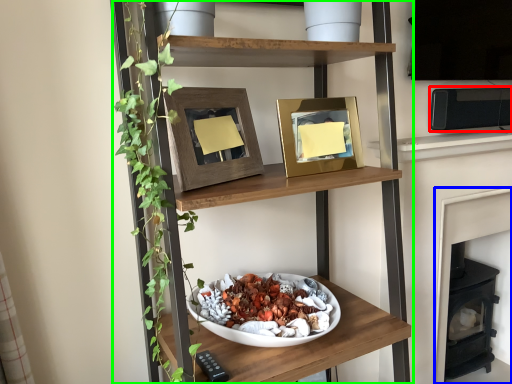
Question: Considering the real-world distances, which object is closest to appliance (highlighted by a red box)? fireplace (highlighted by a blue box) or shelf (highlighted by a green box).

Choices:
 (A) fireplace
 (B) shelf

Answer: (A)